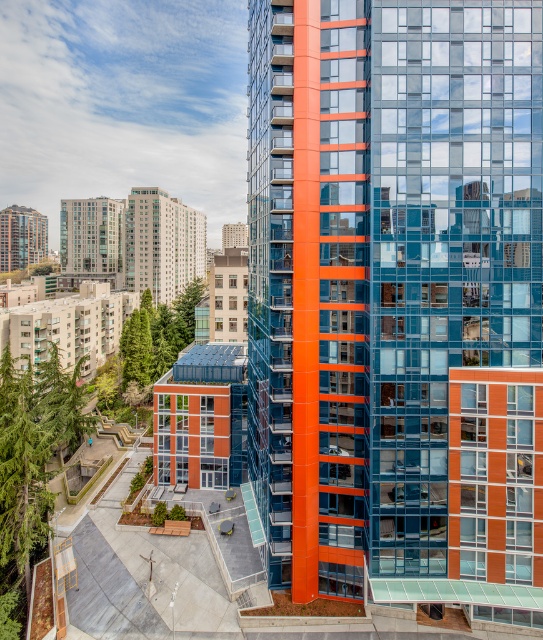
You are an architect reviewing a city plan and notice two buildings in the upper left corner of the image. The city requires that all buildings in this area must not exceed 100 meters in height. Based on their appearance, do you think both the matte glass building at upper left and the orange glass building at upper left comply with the height restriction?

The matte glass building at upper left is much taller than the orange glass building at upper left. Since the city requires buildings in this area to not exceed 100 meters, the matte glass building at upper left may exceed the limit, while the orange glass building at upper left likely complies. However, without exact measurements, this is an estimate based on their relative sizes.

Looking at this image, you are an architect analyzing the modern urban landscape. You notice two buildings at the upper left corner of the image. The first is labeled as the matte glass building at upper left and the second as the orange glass building at upper left. Based on the spatial relationship between them, can you determine which building occupies more horizontal space in the image?

The matte glass building at upper left might be wider than orange glass building at upper left according to the description provided.

You are an architect evaluating the modern urban landscape. You need to determine which building has a wider structure between the orange glass building at center and the matte glass building at center. Which one is wider?

The matte glass building at center is wider than the orange glass building at center according to the description.